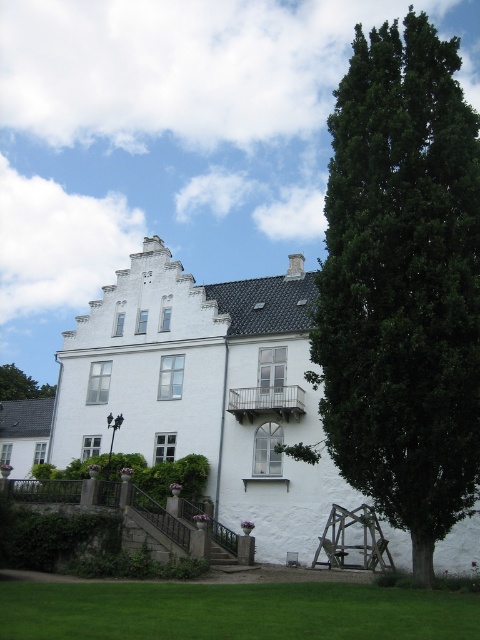
Question: Does green grass at lower center come behind green leafy tree at upper left?

Choices:
 (A) yes
 (B) no

Answer: (B)

Question: Observing the image, what is the correct spatial positioning of green leafy tree at right in reference to green leafy tree at upper left?

Choices:
 (A) right
 (B) left

Answer: (A)

Question: Which point appears closest to the camera in this image?

Choices:
 (A) (38, 388)
 (B) (380, 488)
 (C) (84, 598)

Answer: (C)

Question: Is green leafy tree at right below green grass at lower center?

Choices:
 (A) no
 (B) yes

Answer: (A)

Question: Based on their relative distances, which object is farther from the green leafy tree at right?

Choices:
 (A) green grass at lower center
 (B) green leafy tree at upper left

Answer: (B)

Question: Which object is the farthest from the green leafy tree at upper left?

Choices:
 (A) green grass at lower center
 (B) green leafy tree at right

Answer: (A)